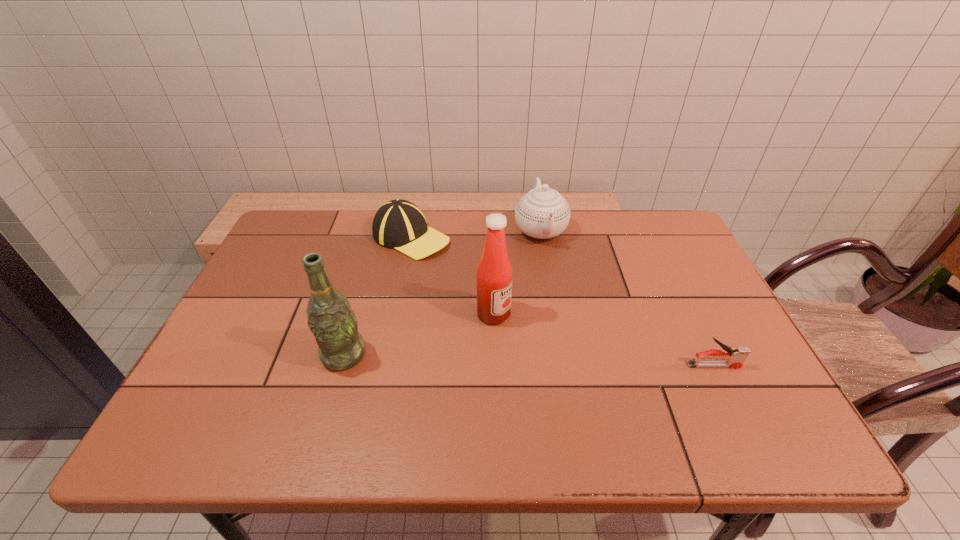
At what (x,y) coordinates should I click in order to perform the action: click on free space that satisfies the following two spatial constraints: 1. on the surface of the beer bottle; 2. on the handle side of the rightmost object. Please return your answer as a coordinate pair (x, y). This screenshot has height=540, width=960. Looking at the image, I should click on (341, 366).

At what (x,y) coordinates should I click in order to perform the action: click on free space that satisfies the following two spatial constraints: 1. on the front side of the stapler; 2. on the handle side of the third farthest object. Please return your answer as a coordinate pair (x, y). This screenshot has height=540, width=960. Looking at the image, I should click on (495, 366).